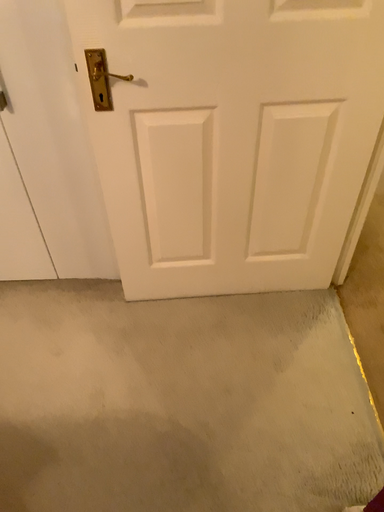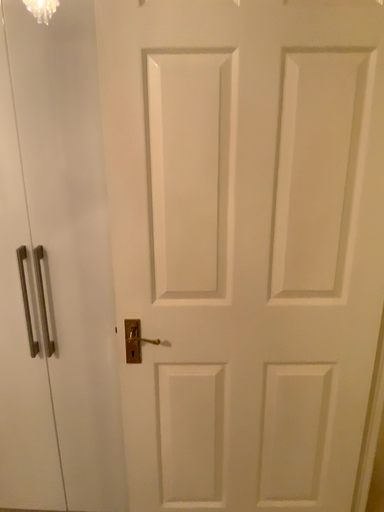
Question: How did the camera likely rotate when shooting the video?

Choices:
 (A) rotated downward
 (B) rotated upward

Answer: (B)